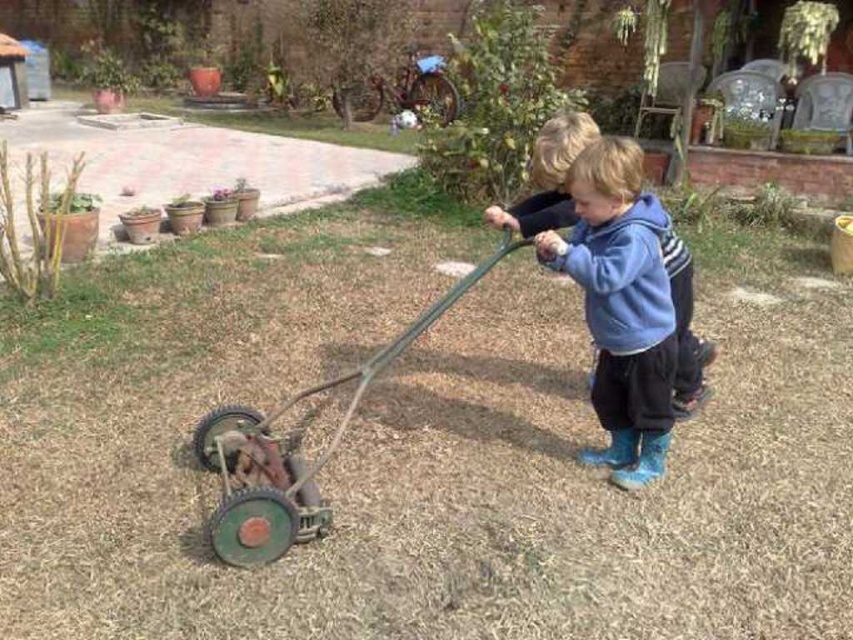
Can you confirm if rusty metal wagon at lower left is thinner than blue fleece hoodie at center?

No, rusty metal wagon at lower left is not thinner than blue fleece hoodie at center.

Which is behind, point (393, 340) or point (564, 186)?

Point (393, 340)

I want to click on rusty metal wagon at lower left, so click(289, 454).